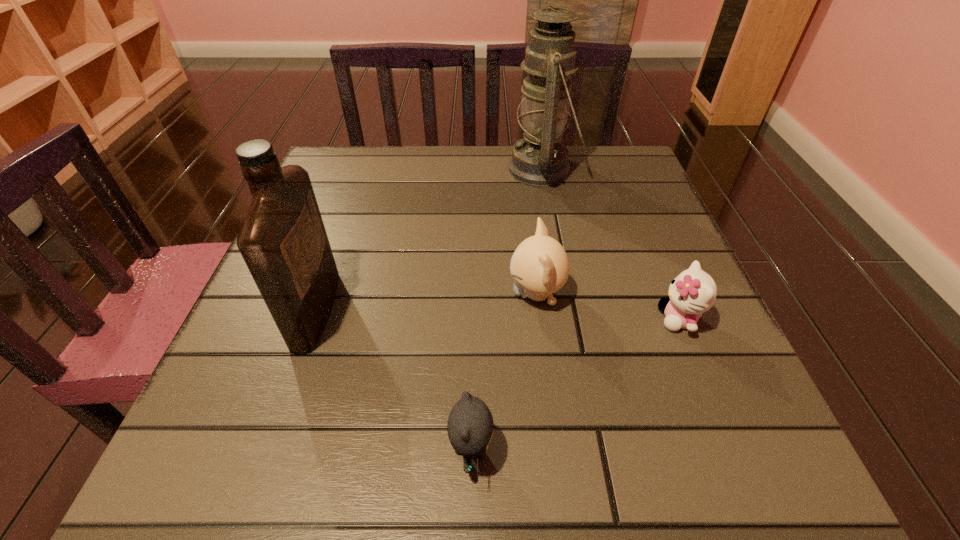
Locate an element on the screen. oil lamp is located at coordinates (540, 159).

Locate an element on the screen. The width and height of the screenshot is (960, 540). the second tallest object is located at coordinates (283, 241).

Where is `the leftmost object`? Image resolution: width=960 pixels, height=540 pixels. the leftmost object is located at coordinates (283, 241).

Identify the location of the third shortest object. The image size is (960, 540). (539, 266).

Locate an element on the screen. This screenshot has width=960, height=540. the second kitten from left to right is located at coordinates (539, 266).

This screenshot has height=540, width=960. I want to click on the rightmost object, so click(693, 292).

Where is `the fourth object from right to left`? This screenshot has width=960, height=540. the fourth object from right to left is located at coordinates (470, 423).

I want to click on the nearest object, so click(470, 423).

The width and height of the screenshot is (960, 540). I want to click on free space located 0.140m on the front of the oil lamp, so click(555, 236).

Where is `vacant space situated 0.100m on the label side of the liquor`? This screenshot has width=960, height=540. vacant space situated 0.100m on the label side of the liquor is located at coordinates (391, 309).